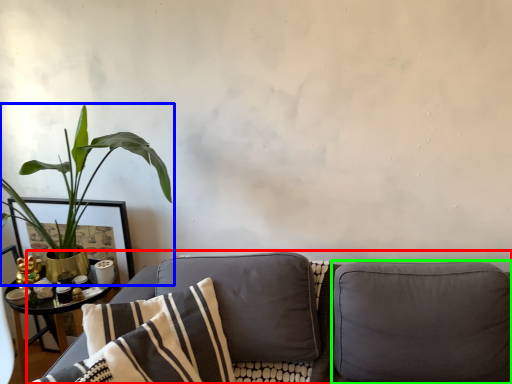
Question: Considering the real-world distances, which object is closest to studio couch (highlighted by a red box)? houseplant (highlighted by a blue box) or pillow (highlighted by a green box).

Choices:
 (A) houseplant
 (B) pillow

Answer: (B)